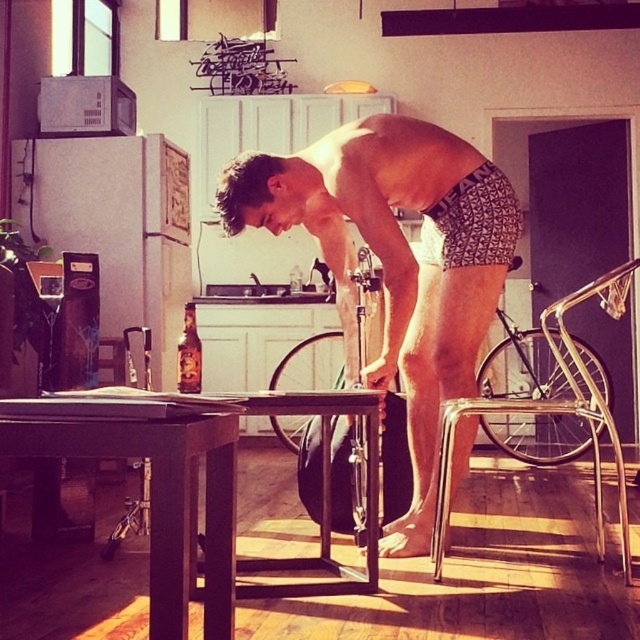
Question: Estimate the real-world distances between objects in this image. Which object is closer to the translucent glass bottle at center?

Choices:
 (A) metallic silver chair at lower right
 (B) dark wood table at center

Answer: (B)

Question: Does patterned fabric shorts at center have a larger size compared to metallic silver chair at lower right?

Choices:
 (A) yes
 (B) no

Answer: (B)

Question: Which point appears closest to the camera in this image?

Choices:
 (A) (605, 404)
 (B) (474, 394)
 (C) (193, 317)

Answer: (C)

Question: Which point is closer to the camera?

Choices:
 (A) (166, 637)
 (B) (548, 408)
 (C) (250, 204)
 (D) (198, 376)

Answer: (A)

Question: Is metallic silver chair at lower right thinner than translucent glass bottle at center?

Choices:
 (A) no
 (B) yes

Answer: (A)

Question: Is dark wood table at center smaller than translucent glass bottle at center?

Choices:
 (A) yes
 (B) no

Answer: (B)